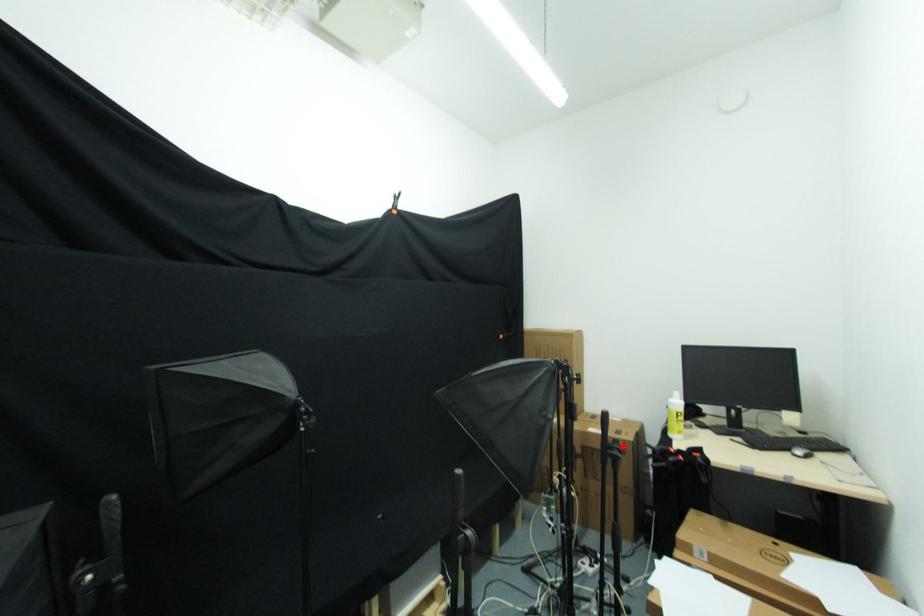
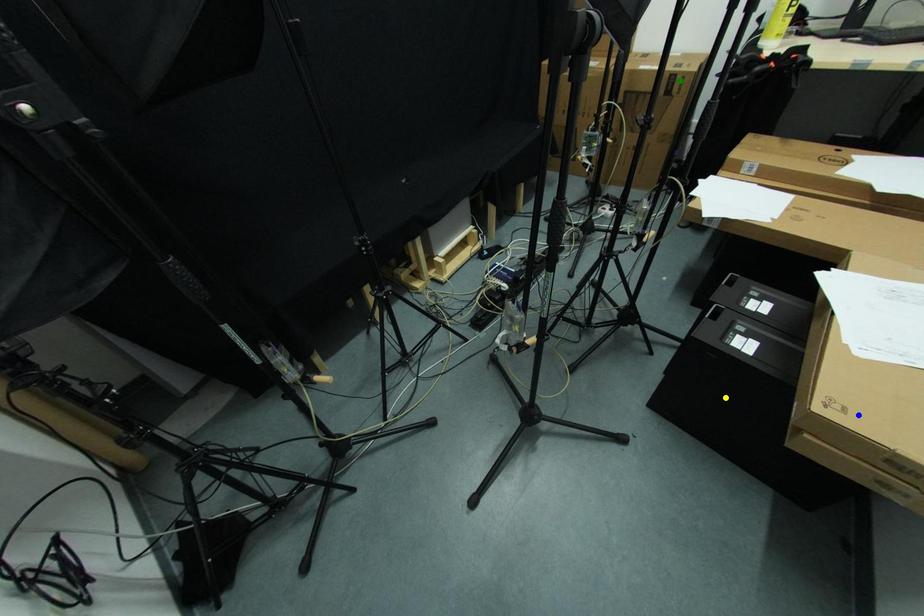
Question: I am providing you with two images of the same scene from different viewpoints. A red point is marked on the first image. You are given multiple points on the second image. Which point in image 2 is actually the same real-world point as the red point in image 1?

Choices:
 (A) blue point
 (B) green point
 (C) yellow point

Answer: (B)